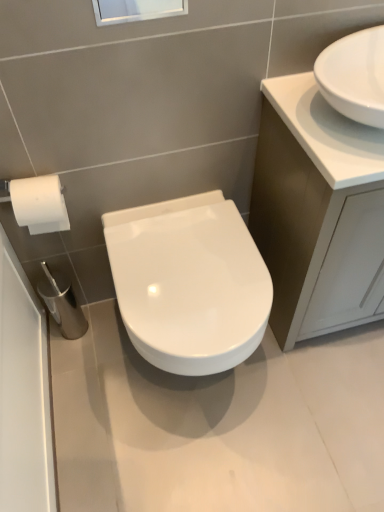
Where is `free point above white glossy toilet at center (from a real-world perspective)`? This screenshot has width=384, height=512. free point above white glossy toilet at center (from a real-world perspective) is located at coordinates (187, 263).